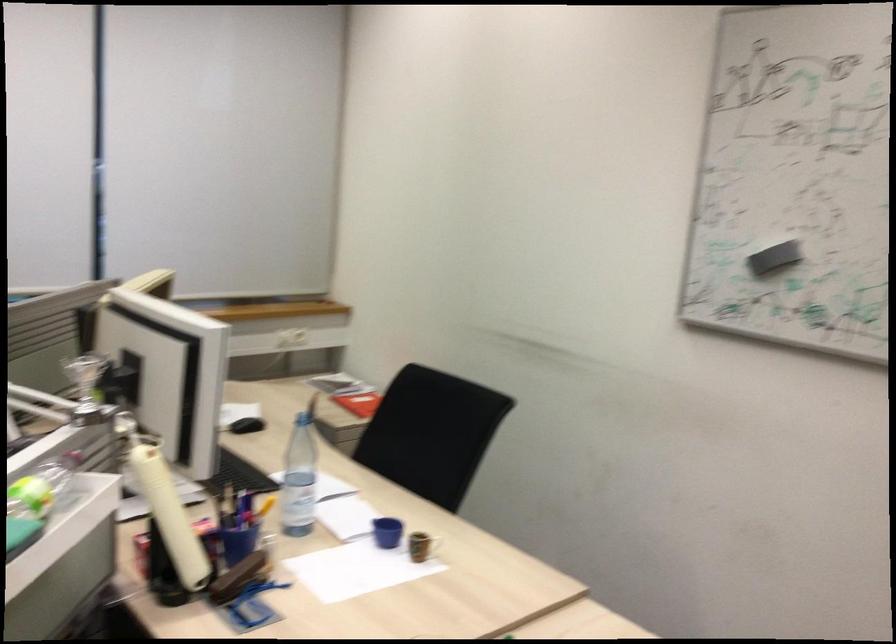
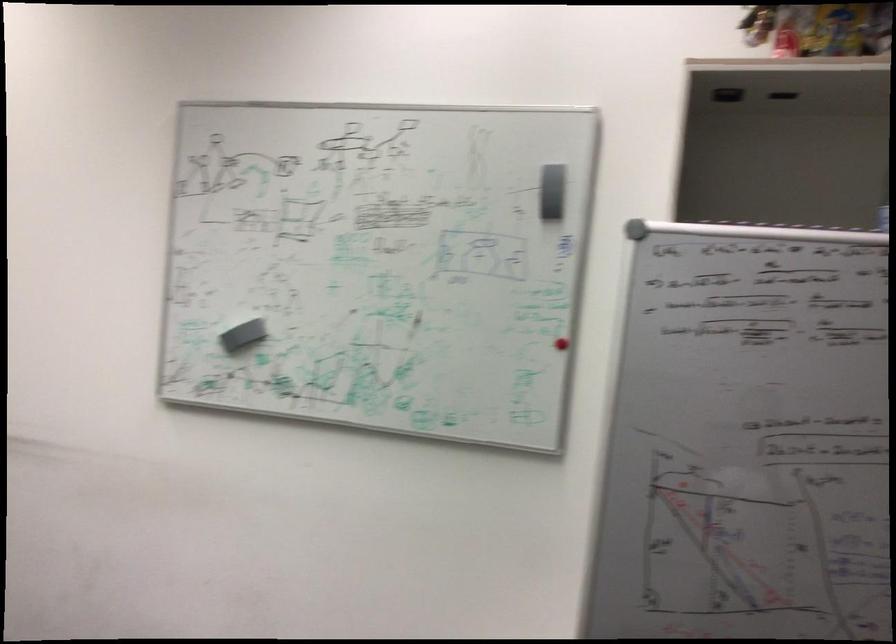
In the second image, find the point that corresponds to the point at 768,252 in the first image.

(239, 330)